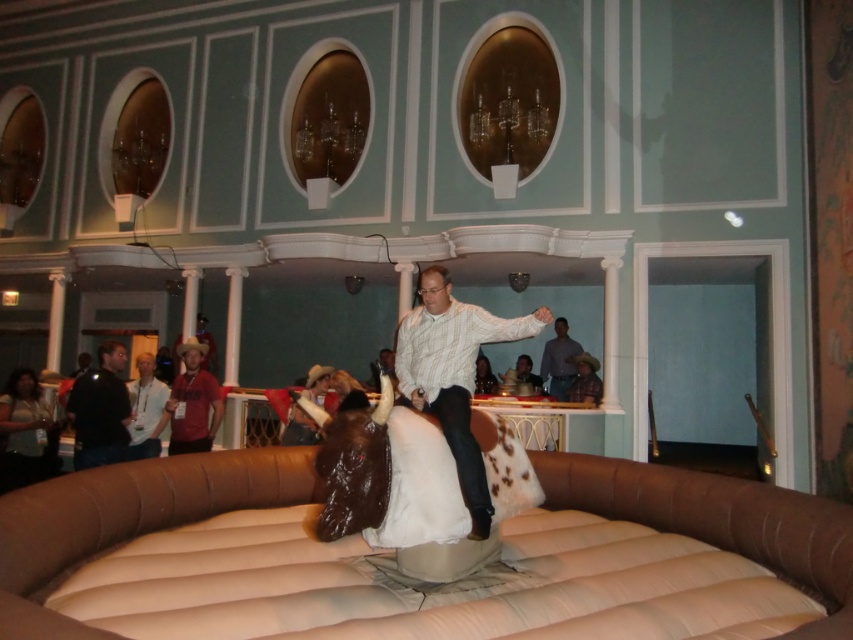
You are a fashion designer observing the indoor mechanical bull riding scene. You notice two jackets in the background. Which jacket is shorter in height between the black leather jacket at left and the brown leather jacket at center?

The black leather jacket at left is shorter in height than the brown leather jacket at center.

You are organizing a rodeo event and need to place a 0.5 meters wide banner between the black leather jacket at left and the mechanical bull. Can you fit the banner between them?

The black leather jacket at left is located at point [100,410], but without knowing the mechanical bull and jacket distance, we can not determine if the banner fits. Please provide more information.